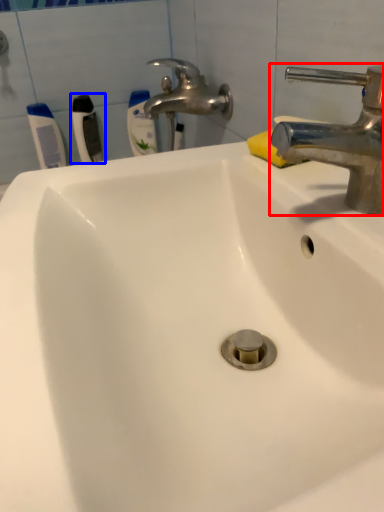
Question: Which object is closer to the camera taking this photo, tap (highlighted by a red box) or toothbrush (highlighted by a blue box)?

Choices:
 (A) tap
 (B) toothbrush

Answer: (A)